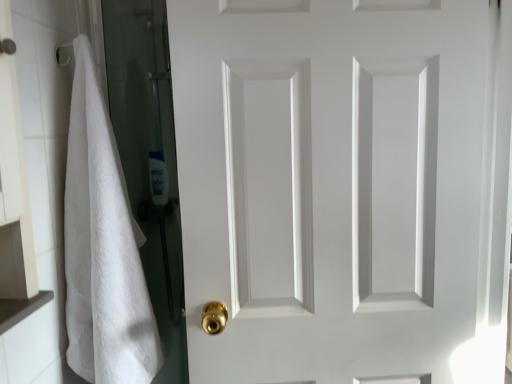
The height and width of the screenshot is (384, 512). I want to click on white matte door at center, so click(330, 185).

This screenshot has height=384, width=512. What do you see at coordinates (330, 185) in the screenshot? I see `white matte door at center` at bounding box center [330, 185].

The width and height of the screenshot is (512, 384). What are the coordinates of `white fluffy towel at left` in the screenshot? It's located at (103, 248).

The image size is (512, 384). What do you see at coordinates (103, 248) in the screenshot? I see `white fluffy towel at left` at bounding box center [103, 248].

The width and height of the screenshot is (512, 384). What are the coordinates of `white matte door at center` in the screenshot? It's located at click(x=330, y=185).

Based on the photo, is white fluffy towel at left at the left side of white matte door at center?

Correct, you'll find white fluffy towel at left to the left of white matte door at center.

From the picture: Considering the relative positions of white fluffy towel at left and white matte door at center in the image provided, is white fluffy towel at left behind white matte door at center?

No, it is in front of white matte door at center.

Considering the points (103, 154) and (410, 47), which point is in front, point (103, 154) or point (410, 47)?

The point (410, 47) is in front.

From the image's perspective, does white fluffy towel at left appear higher than white matte door at center?

No, from the image's perspective, white fluffy towel at left is not over white matte door at center.

From a real-world perspective, does white fluffy towel at left stand above white matte door at center?

Actually, white fluffy towel at left is physically below white matte door at center in the real world.

Is white fluffy towel at left wider than white matte door at center?

Correct, the width of white fluffy towel at left exceeds that of white matte door at center.

Considering the sizes of white fluffy towel at left and white matte door at center in the image, is white fluffy towel at left taller or shorter than white matte door at center?

Clearly, white fluffy towel at left is shorter compared to white matte door at center.

Can you confirm if white fluffy towel at left is smaller than white matte door at center?

Indeed, white fluffy towel at left has a smaller size compared to white matte door at center.

Do you think white fluffy towel at left is within white matte door at center, or outside of it?

white fluffy towel at left lies outside white matte door at center.

Is the surface of white fluffy towel at left in direct contact with white matte door at center?

No, white fluffy towel at left is not making contact with white matte door at center.

Could you tell me if white fluffy towel at left is facing white matte door at center?

Yes, white fluffy towel at left is oriented towards white matte door at center.

The height and width of the screenshot is (384, 512). I want to click on bath towel located on the left of white matte door at center, so click(x=103, y=248).

Between white matte door at center and white fluffy towel at left, which one appears on the right side from the viewer's perspective?

From the viewer's perspective, white matte door at center appears more on the right side.

Which is behind, white matte door at center or white fluffy towel at left?

white matte door at center is further from the camera.

Is point (336, 166) positioned before point (71, 240)?

Yes, it is.

In the scene shown: From the image's perspective, is white matte door at center above white fluffy towel at left?

Yes, from the image's perspective, white matte door at center is over white fluffy towel at left.

From a real-world perspective, is white matte door at center physically located above or below white fluffy towel at left?

white matte door at center is situated higher than white fluffy towel at left in the real world.

Can you confirm if white matte door at center is wider than white fluffy towel at left?

In fact, white matte door at center might be narrower than white fluffy towel at left.

Is white matte door at center taller or shorter than white fluffy towel at left?

Considering their sizes, white matte door at center has more height than white fluffy towel at left.

Between white matte door at center and white fluffy towel at left, which one has larger size?

With larger size is white matte door at center.

Is white matte door at center surrounding white fluffy towel at left?

Definitely not — white fluffy towel at left is not inside white matte door at center.

Is white matte door at center not close to white fluffy towel at left?

That's not correct — white matte door at center is a little close to white fluffy towel at left.

Is white matte door at center oriented away from white fluffy towel at left?

white matte door at center is not turned away from white fluffy towel at left.

The image size is (512, 384). I want to click on bath towel lying below the white matte door at center (from the image's perspective), so (103, 248).

This screenshot has height=384, width=512. In order to click on bath towel that is below the white matte door at center (from the image's perspective) in this screenshot , I will do `click(103, 248)`.

Where is `door that appears above the white fluffy towel at left (from the image's perspective)`? The width and height of the screenshot is (512, 384). door that appears above the white fluffy towel at left (from the image's perspective) is located at coordinates (330, 185).